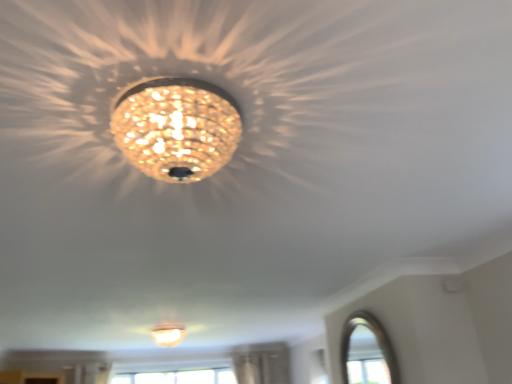
What is the approximate height of matte white lampshade at center, acting as the 2th lamp starting from the front?

It is 9.10 inches.

This screenshot has width=512, height=384. What are the coordinates of `clear glass window at lower right` in the screenshot? It's located at pyautogui.click(x=367, y=352).

The image size is (512, 384). What do you see at coordinates (367, 352) in the screenshot? I see `clear glass window at lower right` at bounding box center [367, 352].

Identify the location of matte white lampshade at center, positioned as the 1th lamp in back-to-front order. (168, 334).

Which is in front, point (189, 177) or point (348, 353)?

Point (189, 177)

From the image's perspective, is matte gold chandelier at center, which appears as the 2th lamp when ordered from the bottom, above or below clear glass window at lower right?

matte gold chandelier at center, which appears as the 2th lamp when ordered from the bottom, is situated higher than clear glass window at lower right in the image.

From a real-world perspective, is matte gold chandelier at center, positioned as the 1th lamp in right-to-left order, on top of clear glass window at lower right?

Yes, from a real-world perspective, matte gold chandelier at center, positioned as the 1th lamp in right-to-left order, is above clear glass window at lower right.

In the scene shown: Are matte gold chandelier at center, positioned as the 1th lamp in right-to-left order, and clear glass window at lower right making contact?

They are not placed beside each other.

Image resolution: width=512 pixels, height=384 pixels. Identify the location of window on the right of the matte white lampshade at center, positioned as the first lamp in bottom-to-top order. (367, 352).

Could you tell me if clear glass window at lower right is turned towards matte white lampshade at center, positioned as the first lamp in bottom-to-top order?

No, clear glass window at lower right is not turned towards matte white lampshade at center, positioned as the first lamp in bottom-to-top order.

Between point (361, 338) and point (160, 327), which one is positioned behind?

Positioned behind is point (160, 327).

Does clear glass window at lower right have a lesser height compared to matte white lampshade at center, the second lamp from the right?

No.

Considering the sizes of objects matte white lampshade at center, arranged as the second lamp when viewed from the top, and clear glass window at lower right in the image provided, who is smaller, matte white lampshade at center, arranged as the second lamp when viewed from the top, or clear glass window at lower right?

With smaller size is clear glass window at lower right.

Could you tell me if matte white lampshade at center, the second lamp from the right, is facing clear glass window at lower right?

No, matte white lampshade at center, the second lamp from the right, is not oriented towards clear glass window at lower right.

Between matte white lampshade at center, the second lamp from the right, and clear glass window at lower right, which one appears on the right side from the viewer's perspective?

clear glass window at lower right is more to the right.

Measure the distance from matte gold chandelier at center, positioned as the 1th lamp in right-to-left order, to matte white lampshade at center, positioned as the first lamp in bottom-to-top order.

3.62 meters.

Consider the image. From the image's perspective, which is above, matte gold chandelier at center, the first lamp positioned from the top, or matte white lampshade at center, arranged as the second lamp when viewed from the top?

matte gold chandelier at center, the first lamp positioned from the top.

Is point (157, 144) in front of point (158, 340)?

That is True.

From a real-world perspective, is matte gold chandelier at center, the first lamp positioned from the top, located higher than matte white lampshade at center, which ranks as the 1th lamp in left-to-right order?

Indeed, from a real-world perspective, matte gold chandelier at center, the first lamp positioned from the top, stands above matte white lampshade at center, which ranks as the 1th lamp in left-to-right order.

Considering the relative sizes of matte white lampshade at center, acting as the 2th lamp starting from the front, and matte gold chandelier at center, the 1th lamp when ordered from front to back, in the image provided, is matte white lampshade at center, acting as the 2th lamp starting from the front, smaller than matte gold chandelier at center, the 1th lamp when ordered from front to back,?

Actually, matte white lampshade at center, acting as the 2th lamp starting from the front, might be larger than matte gold chandelier at center, the 1th lamp when ordered from front to back.

Between matte white lampshade at center, arranged as the second lamp when viewed from the top, and matte gold chandelier at center, the 1th lamp when ordered from front to back, which one has larger width?

matte white lampshade at center, arranged as the second lamp when viewed from the top, is wider.

The height and width of the screenshot is (384, 512). In order to click on lamp lying behind the matte gold chandelier at center, positioned as the 1th lamp in right-to-left order in this screenshot , I will do `click(168, 334)`.

Does matte white lampshade at center, the second lamp from the right, appear on the left side of matte gold chandelier at center, which appears as the 2th lamp when viewed from the left?

Correct, you'll find matte white lampshade at center, the second lamp from the right, to the left of matte gold chandelier at center, which appears as the 2th lamp when viewed from the left.

Can you confirm if clear glass window at lower right is bigger than matte gold chandelier at center, the 1th lamp when ordered from front to back?

Incorrect, clear glass window at lower right is not larger than matte gold chandelier at center, the 1th lamp when ordered from front to back.

Is clear glass window at lower right at the right side of matte gold chandelier at center, which is the 2th lamp in back-to-front order?

Indeed, clear glass window at lower right is positioned on the right side of matte gold chandelier at center, which is the 2th lamp in back-to-front order.

Is point (360, 339) in front of point (193, 81)?

No, (360, 339) is behind (193, 81).

I want to click on the 2nd lamp located above the clear glass window at lower right (from a real-world perspective), so pyautogui.click(x=177, y=128).

Find the location of a particular element. The height and width of the screenshot is (384, 512). window in front of the matte white lampshade at center, arranged as the second lamp when viewed from the top is located at coordinates (367, 352).

Based on their spatial positions, is matte white lampshade at center, arranged as the second lamp when viewed from the top, or clear glass window at lower right closer to matte gold chandelier at center, the first lamp positioned from the top?

clear glass window at lower right is positioned closer to the anchor matte gold chandelier at center, the first lamp positioned from the top.

From the picture: Considering their positions, is matte gold chandelier at center, the first lamp positioned from the top, positioned further to clear glass window at lower right than matte white lampshade at center, positioned as the first lamp in bottom-to-top order?

matte gold chandelier at center, the first lamp positioned from the top, lies further to clear glass window at lower right than the other object.

From the image, which object appears to be nearer to matte white lampshade at center, acting as the 2th lamp starting from the front, matte gold chandelier at center, which appears as the 2th lamp when ordered from the bottom, or clear glass window at lower right?

Among the two, clear glass window at lower right is located nearer to matte white lampshade at center, acting as the 2th lamp starting from the front.

Based on their spatial positions, is matte white lampshade at center, which ranks as the 1th lamp in left-to-right order, or matte gold chandelier at center, the first lamp positioned from the top, closer to clear glass window at lower right?

Based on the image, matte white lampshade at center, which ranks as the 1th lamp in left-to-right order, appears to be nearer to clear glass window at lower right.

From the image, which object appears to be farther from matte gold chandelier at center, which appears as the 2th lamp when viewed from the left, clear glass window at lower right or matte white lampshade at center, positioned as the first lamp in bottom-to-top order?

Based on the image, matte white lampshade at center, positioned as the first lamp in bottom-to-top order, appears to be further to matte gold chandelier at center, which appears as the 2th lamp when viewed from the left.

From the image, which object appears to be nearer to matte white lampshade at center, positioned as the first lamp in bottom-to-top order, clear glass window at lower right or matte gold chandelier at center, which appears as the 2th lamp when ordered from the bottom?

The object closer to matte white lampshade at center, positioned as the first lamp in bottom-to-top order, is clear glass window at lower right.

Locate an element on the screen. This screenshot has width=512, height=384. window between matte gold chandelier at center, which is the 2th lamp in back-to-front order, and matte white lampshade at center, acting as the 2th lamp starting from the front, from front to back is located at coordinates (367, 352).